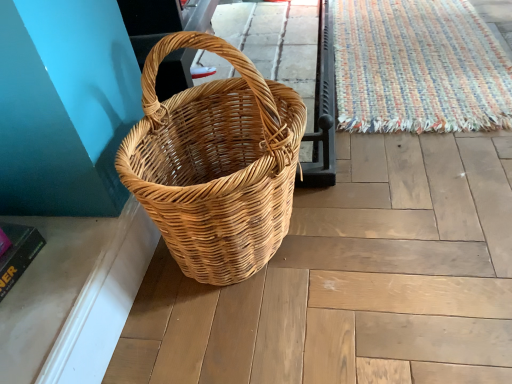
Question: In the image, is woven wood basket at left on the left side or the right side of woven multicolored mat at upper right?

Choices:
 (A) left
 (B) right

Answer: (A)

Question: Is point (133, 132) positioned closer to the camera than point (359, 4)?

Choices:
 (A) closer
 (B) farther

Answer: (A)

Question: Based on their sizes in the image, would you say woven wood basket at left is bigger or smaller than woven multicolored mat at upper right?

Choices:
 (A) small
 (B) big

Answer: (B)

Question: In terms of width, does woven multicolored mat at upper right look wider or thinner when compared to woven wood basket at left?

Choices:
 (A) thin
 (B) wide

Answer: (B)

Question: From their relative heights in the image, would you say woven multicolored mat at upper right is taller or shorter than woven wood basket at left?

Choices:
 (A) short
 (B) tall

Answer: (A)

Question: Considering the positions of woven multicolored mat at upper right and woven wood basket at left in the image, is woven multicolored mat at upper right bigger or smaller than woven wood basket at left?

Choices:
 (A) small
 (B) big

Answer: (A)

Question: Is woven multicolored mat at upper right to the left or to the right of woven wood basket at left in the image?

Choices:
 (A) right
 (B) left

Answer: (A)